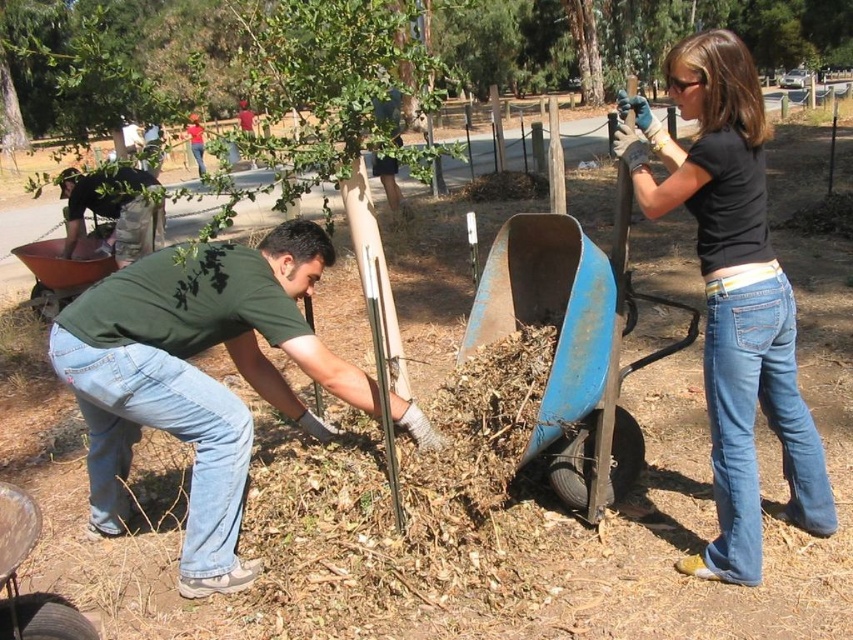
You are standing in the park and see the green matte shirt at lower left and the green leafy tree at upper center. Which object is positioned higher in the image?

The green leafy tree at upper center is positioned higher in the image than the green matte shirt at lower left.

Based on the scene description, which object is taller between the black cotton shirt at upper right and the camouflage pants at left?

The black cotton shirt at upper right is taller than the camouflage pants at left.

Consider the image. You are a photographer standing at the edge of the park pathway. You want to capture a photo that includes both the green matte shirt at lower left and the green leafy tree at upper center. Which object should you focus on first if you want to ensure both are in the frame?

Answer: You should focus on the green leafy tree at upper center first because it is taller than the green matte shirt at lower left, so adjusting the camera angle to include its height will naturally include the shorter object in the frame.